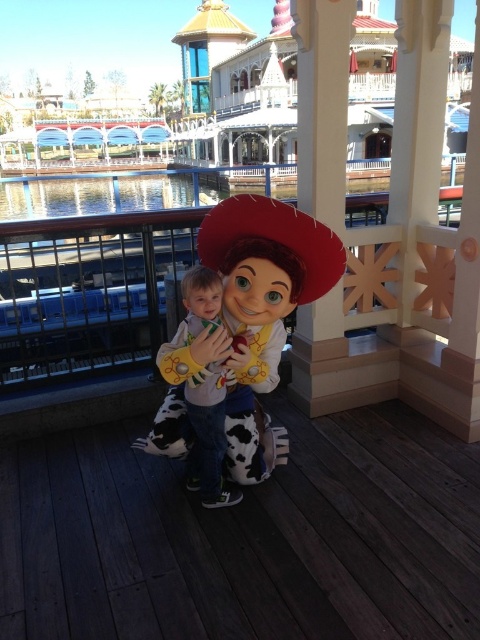
You are a maintenance worker at the theme park and need to inspect the wooden deck at center and the cowboy hat at center. The safety regulations state that the minimum distance between any two attractions must be at least 30 inches. Based on the scene, will you need to adjust their positions?

The distance between the wooden deck at center and the cowboy hat at center is 29.17 inches, which is less than the required 30 inches. Therefore, adjustments are needed to meet safety regulations.

You are a photographer trying to capture a wide shot of the wooden deck at center and the cowboy hat at center. Given that your camera can only focus on objects larger than 10 inches, will both objects be in focus?

The wooden deck at center is bigger than cowboy hat at center, but the exact sizes are not provided. However, since the camera focuses on objects larger than 10 inches, we can confirm that the wooden deck at center will be in focus. The cowboy hat at center might not be if it is smaller than 10 inches, but its size isn

You are standing at the point marked as point (245, 538) in the image. What is the object located exactly at this point?

The point (245, 538) marks the wooden deck at center.